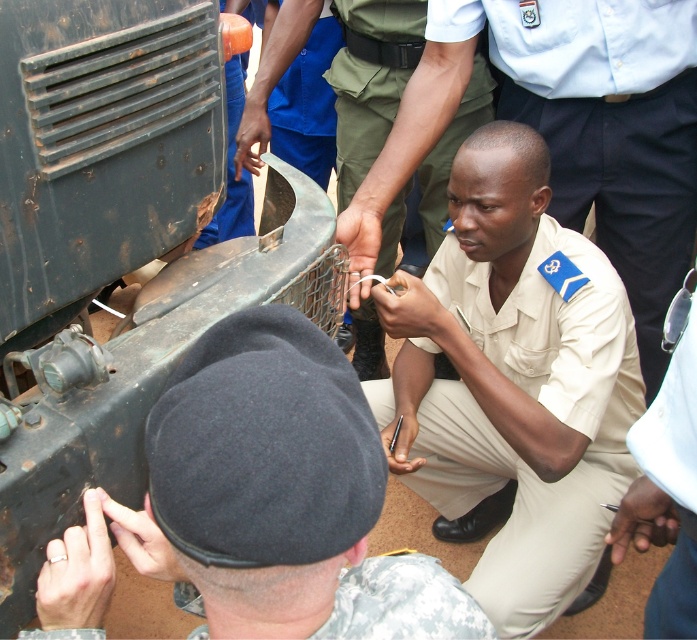
The image size is (697, 640). What do you see at coordinates (543, 406) in the screenshot?
I see `beige fabric shirt at center` at bounding box center [543, 406].

Between beige fabric shirt at center and khaki fabric shirt at center, which one has less height?

beige fabric shirt at center

Which is behind, point (576, 371) or point (344, 196)?

The point (344, 196) is behind.

Locate an element on the screen. beige fabric shirt at center is located at coordinates (543, 406).

Between camouflage fabric beret at lower left and blue fabric pants at upper center, which one is positioned lower?

camouflage fabric beret at lower left

Is point (358, 618) in front of point (229, 10)?

Yes, point (358, 618) is closer to viewer.

Find the location of a particular element. Image resolution: width=697 pixels, height=640 pixels. camouflage fabric beret at lower left is located at coordinates (401, 602).

Where is `camouflage fabric beret at lower left`? camouflage fabric beret at lower left is located at coordinates (x=401, y=602).

Does point (681, 109) come closer to viewer compared to point (480, 68)?

Yes, point (681, 109) is closer to viewer.

Image resolution: width=697 pixels, height=640 pixels. I want to click on beige uniform at center, so click(569, 129).